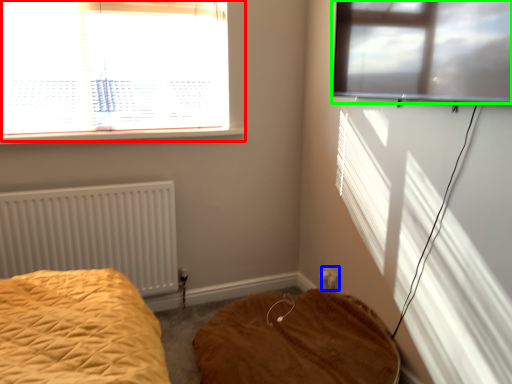
Question: Estimate the real-world distances between objects in this image. Which object is farther from window (highlighted by a red box), electric outlet (highlighted by a blue box) or window (highlighted by a green box)?

Choices:
 (A) electric outlet
 (B) window

Answer: (A)